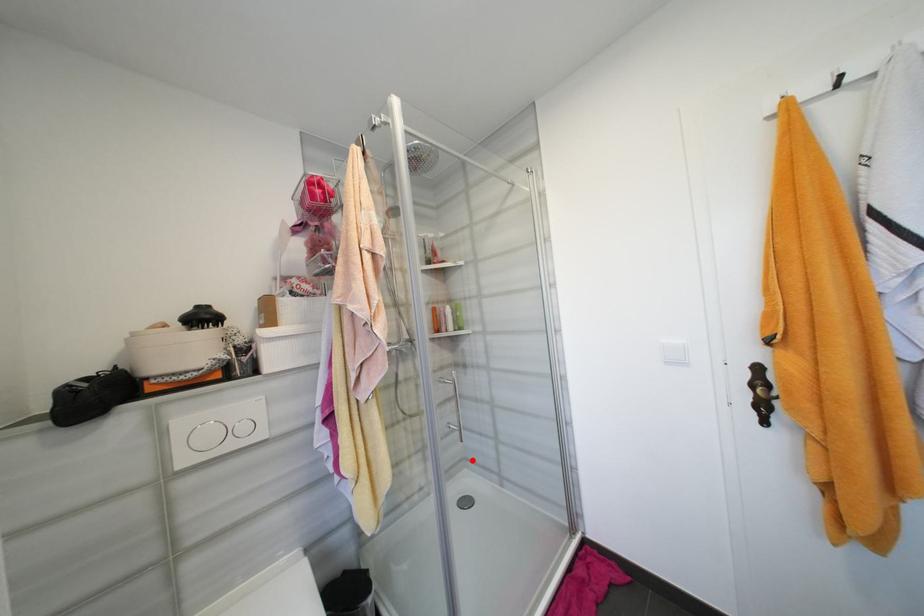
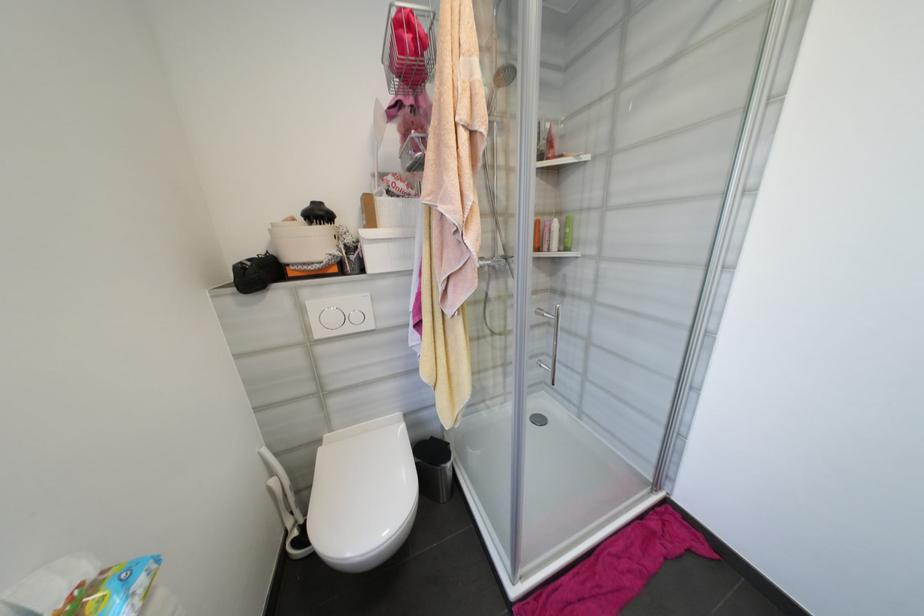
Question: I am providing you with two images of the same scene from different viewpoints. A red point is shown in image1. For the corresponding object point in image2, is it positioned nearer or farther from the camera?

Choices:
 (A) Nearer
 (B) Farther

Answer: (B)